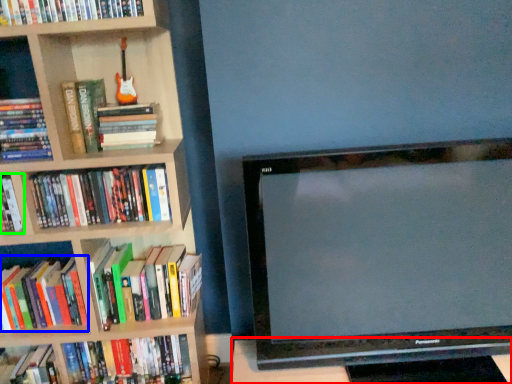
Question: Based on their relative distances, which object is nearer to table (highlighted by a red box)? Choose from book (highlighted by a blue box) and book (highlighted by a green box).

Choices:
 (A) book
 (B) book

Answer: (A)